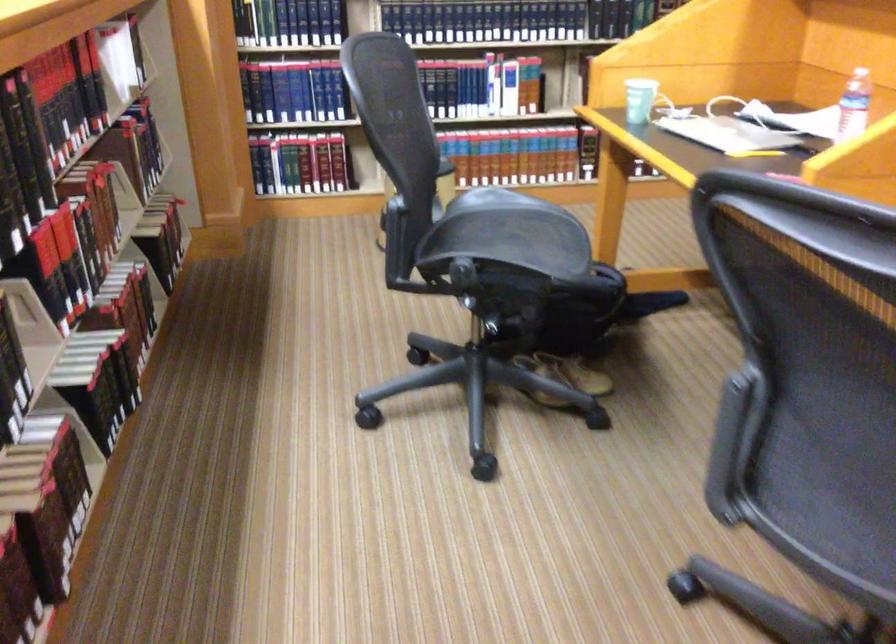
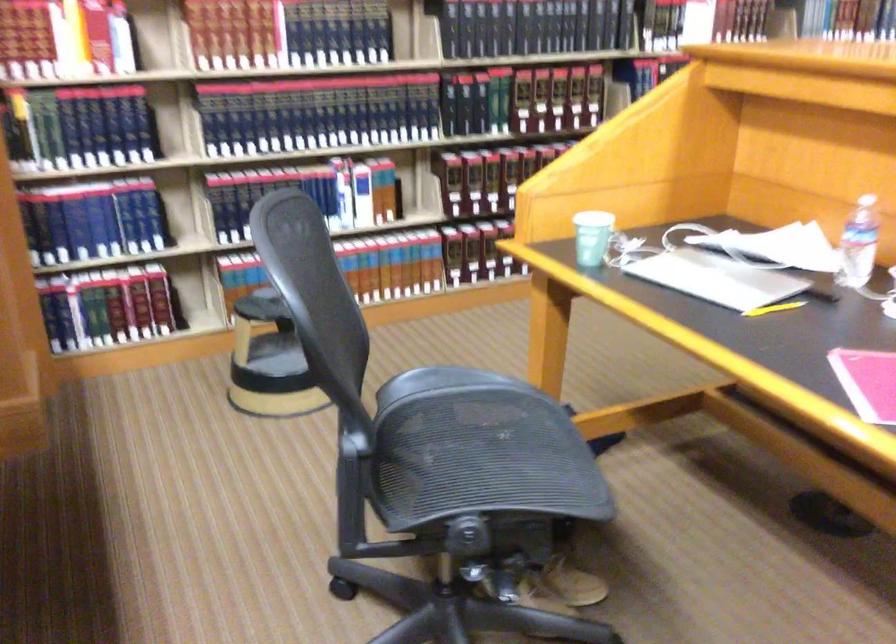
Where in the second image is the point corresponding to point (769, 111) from the first image?

(739, 247)